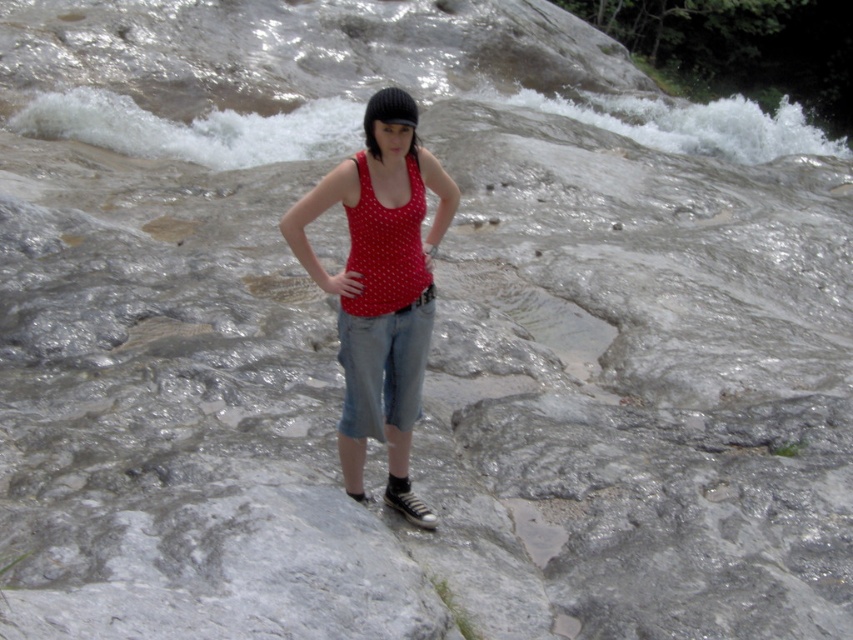
Who is higher up, polka dot fabric tank top at center or denim at center?

Positioned higher is polka dot fabric tank top at center.

Does polka dot fabric tank top at center lie behind denim at center?

No, it is in front of denim at center.

Which is behind, point (413, 378) or point (407, 387)?

Point (407, 387)

What are the coordinates of `polka dot fabric tank top at center` in the screenshot? It's located at (381, 288).

Is polka dot fabric tank top at center closer to the viewer compared to red polka dot tank top at center?

Yes, polka dot fabric tank top at center is closer to the viewer.

Can you confirm if polka dot fabric tank top at center is positioned to the right of red polka dot tank top at center?

No, polka dot fabric tank top at center is not to the right of red polka dot tank top at center.

The height and width of the screenshot is (640, 853). Find the location of `polka dot fabric tank top at center`. polka dot fabric tank top at center is located at coordinates (381, 288).

Does denim at center have a lesser width compared to red polka dot tank top at center?

No.

Is denim at center positioned in front of red polka dot tank top at center?

No.

Between point (389, 348) and point (422, 198), which one is positioned behind?

Positioned behind is point (389, 348).

Where is `denim at center`? This screenshot has height=640, width=853. denim at center is located at coordinates (383, 368).